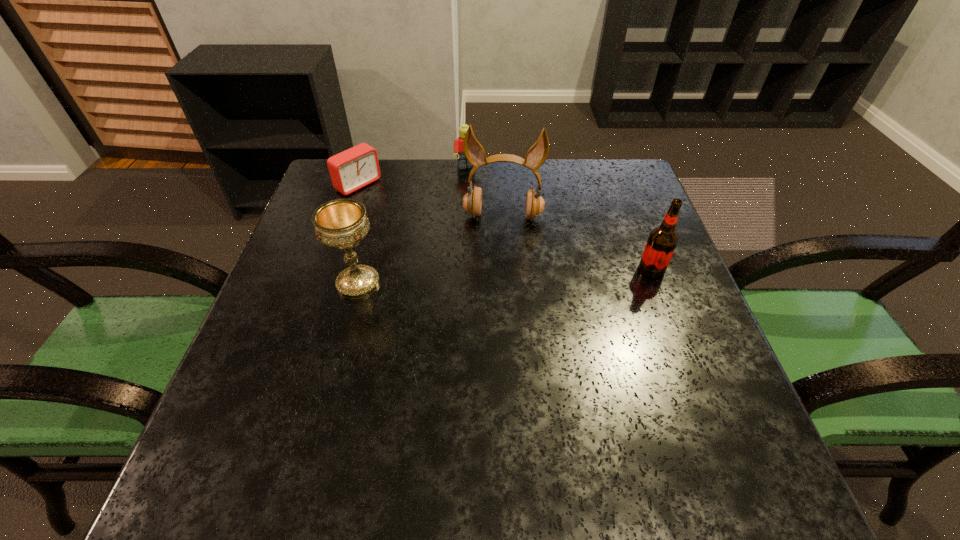
Identify the location of free space on the desktop that is between the chalice and the rightmost object and is positioned on the face of the farthest object. The image size is (960, 540). pyautogui.click(x=518, y=275).

This screenshot has width=960, height=540. I want to click on vacant spot on the desktop that is between the chalice and the root beer and is positioned on the front-facing side of the shortest object, so click(495, 276).

Image resolution: width=960 pixels, height=540 pixels. I want to click on vacant space on the desktop that is between the chalice and the rightmost object and is positioned on the front-facing side of the third farthest object, so click(498, 276).